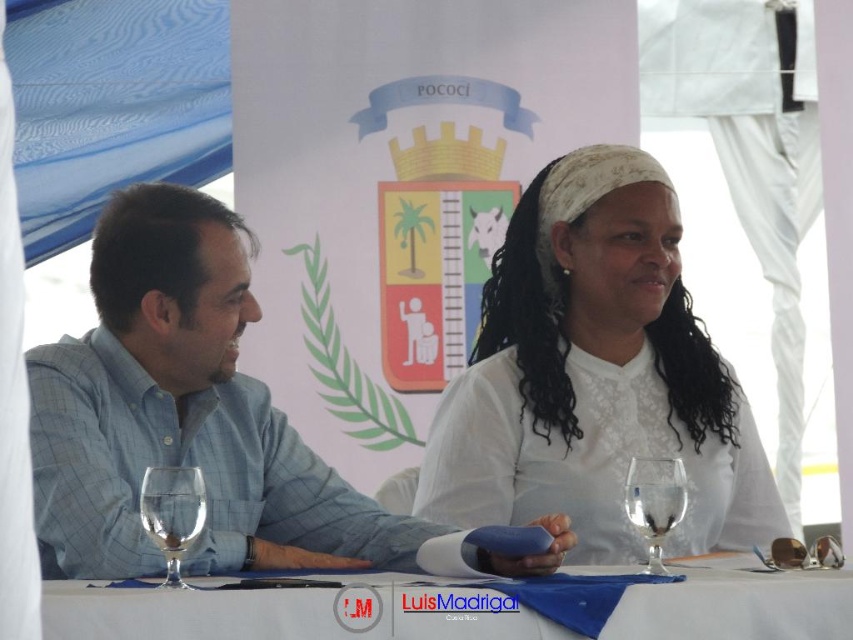
You are standing at the point with coordinates point (210, 387) and want to walk to the point with coordinates point (465, 410). Given the scene described, will you be moving towards the background or the foreground?

Since point (465, 410) is behind point (210, 387), moving from point (210, 387) to point (465, 410) means you are moving towards the background.

You are a photographer standing at the center of the image. You want to focus your camera on the blue plaid shirt at left. What are the coordinates you should aim for?

The coordinates to focus on the blue plaid shirt at left are at point (183, 413).

You are a photographer at an event and need to position a light to the right of both the white lace blouse at center and the blue plaid shirt at left. Where should you place the light?

The light should be placed to the right of the white lace blouse at center since it is already to the right of the blue plaid shirt at left, so positioning it further right would ensure it is to the right of both.